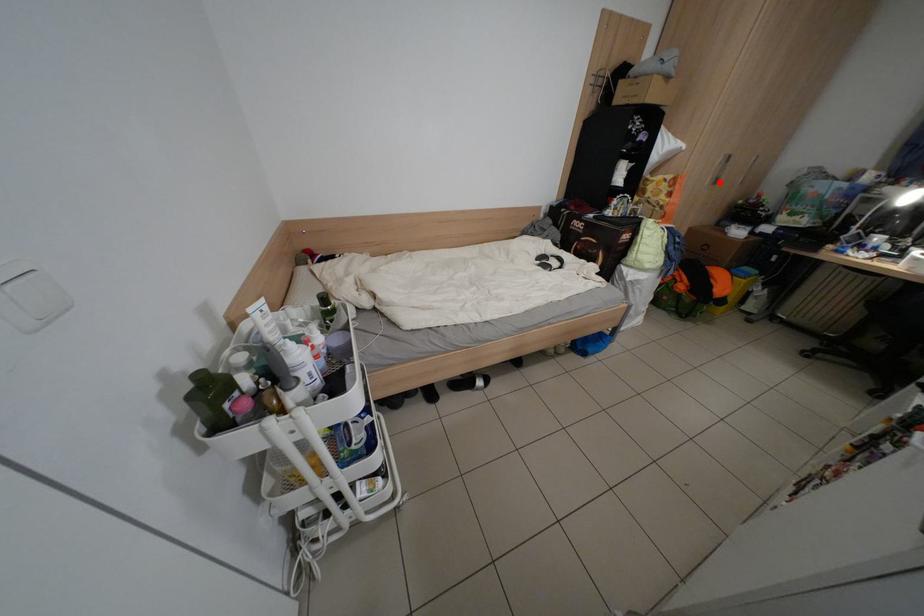
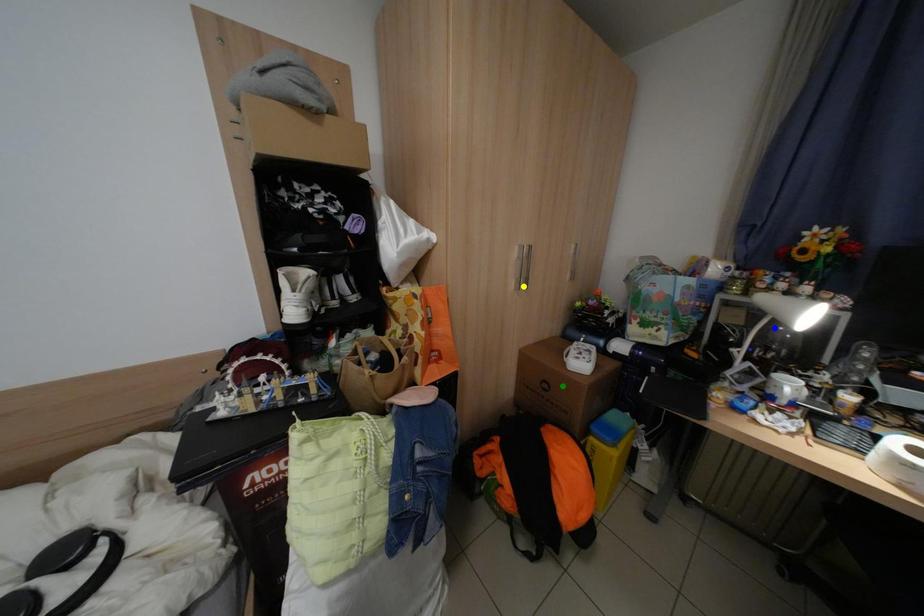
Question: I am providing you with two images of the same scene from different viewpoints. A red point is marked on the first image. You are given multiple points on the second image. Which point in image 2 is actually the same real-world point as the red point in image 1?

Choices:
 (A) green point
 (B) blue point
 (C) yellow point

Answer: (C)